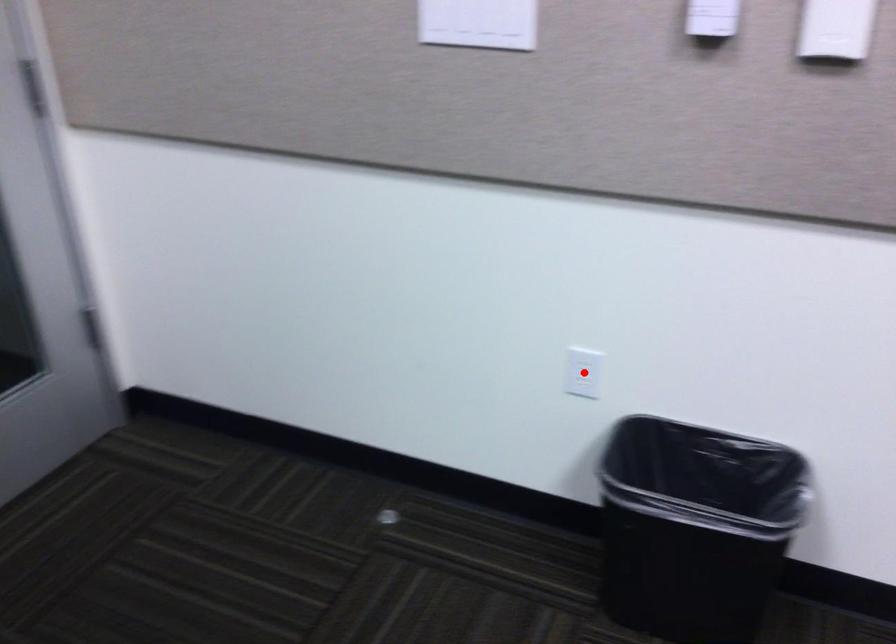
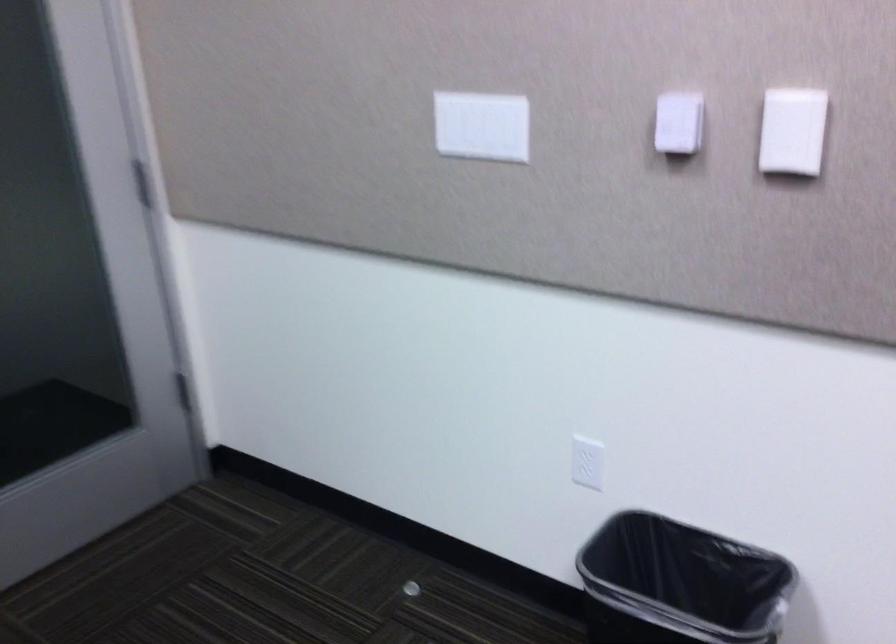
Where in the second image is the point corresponding to the highlighted location from the first image?

(587, 462)